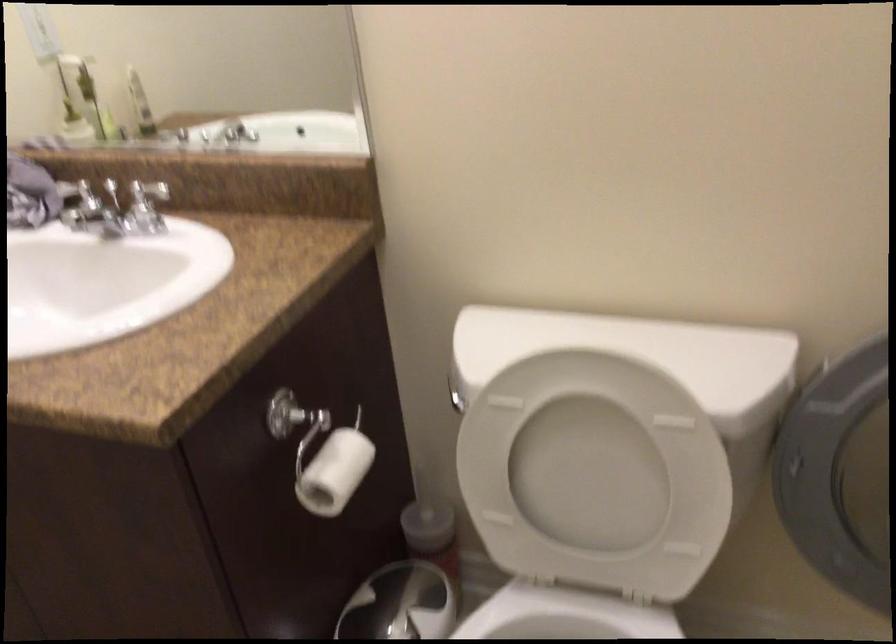
The image size is (896, 644). What do you see at coordinates (70, 111) in the screenshot?
I see `the green bottle pump` at bounding box center [70, 111].